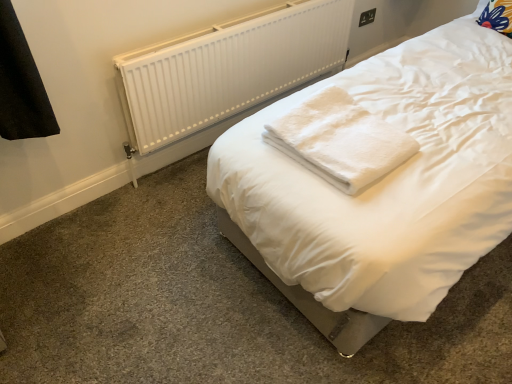
Question: Looking at their shapes, would you say white plastic radiator at upper center is wider or thinner than black plastic electric outlet at upper right?

Choices:
 (A) wide
 (B) thin

Answer: (A)

Question: From the image's perspective, is white plastic radiator at upper center located above or below black plastic electric outlet at upper right?

Choices:
 (A) above
 (B) below

Answer: (B)

Question: Which object is the closest to the white plastic radiator at upper center?

Choices:
 (A) black plastic electric outlet at upper right
 (B) white fluffy towel at center

Answer: (B)

Question: Estimate the real-world distances between objects in this image. Which object is farther from the white fluffy towel at center?

Choices:
 (A) white plastic radiator at upper center
 (B) black plastic electric outlet at upper right

Answer: (B)